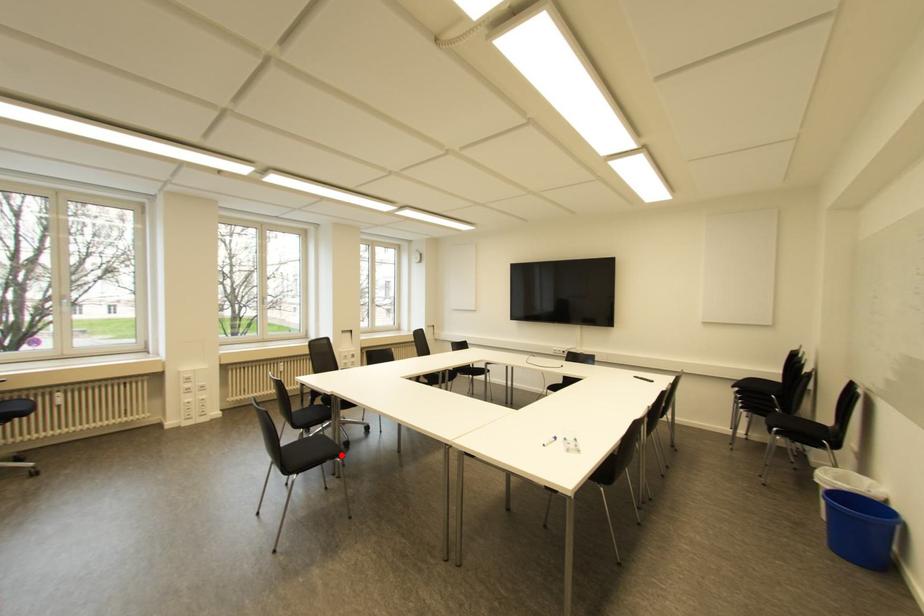
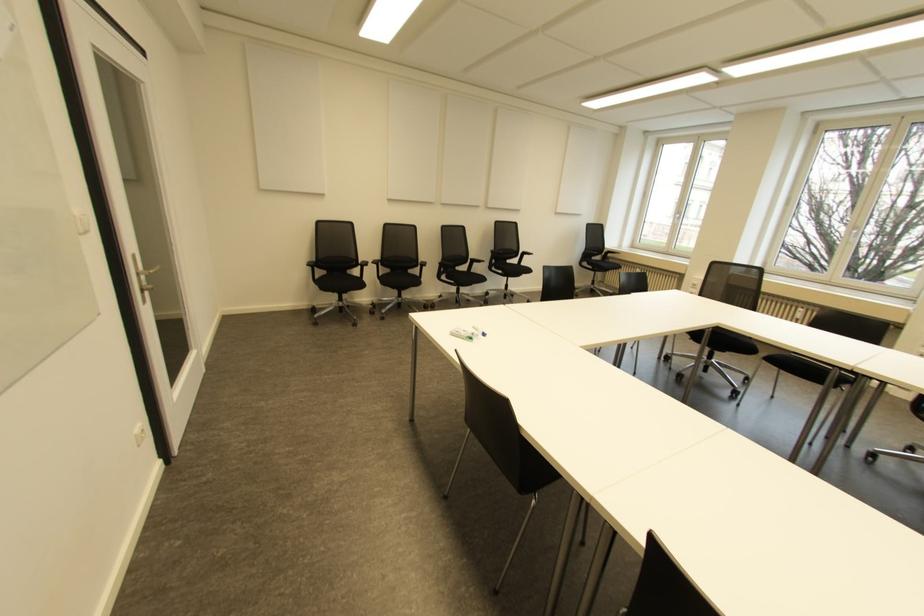
Question: I am providing you with two images of the same scene from different viewpoints. A red point is marked on the first image. At the location where the point appears in image 1, is it still visible in image 2?

Choices:
 (A) Yes
 (B) No

Answer: (B)